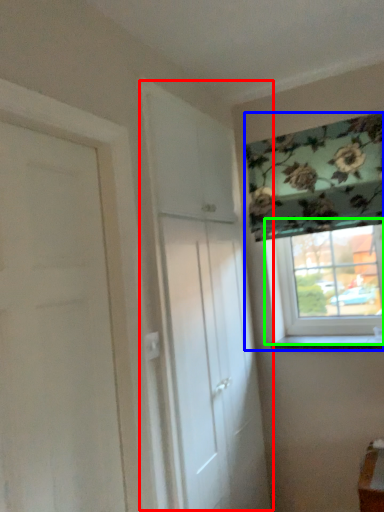
Question: Which is farther away from door (highlighted by a red box)? window (highlighted by a blue box) or window (highlighted by a green box)?

Choices:
 (A) window
 (B) window

Answer: (B)